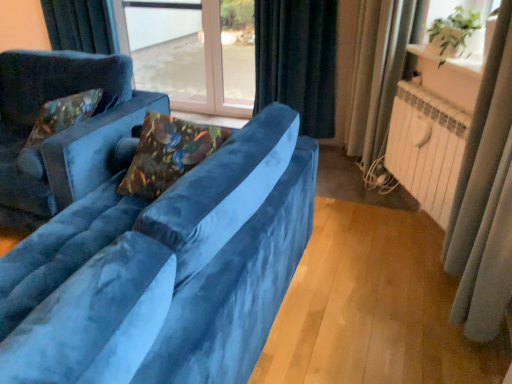
At what (x,y) coordinates should I click in order to perform the action: click on free spot below white painted metal radiator at right (from a real-world perspective). Please return your answer as a coordinate pair (x, y). The height and width of the screenshot is (384, 512). Looking at the image, I should click on (413, 222).